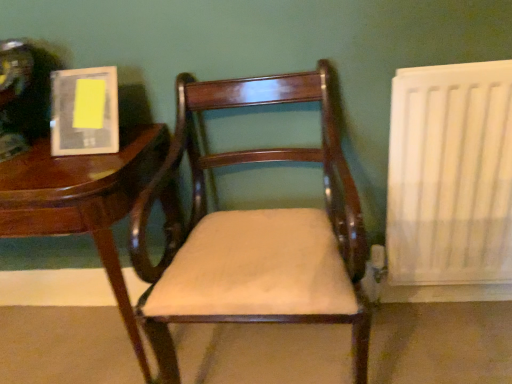
Image resolution: width=512 pixels, height=384 pixels. Find the location of `vacant space that is to the left of matte plastic book at upper left`. vacant space that is to the left of matte plastic book at upper left is located at coordinates (31, 153).